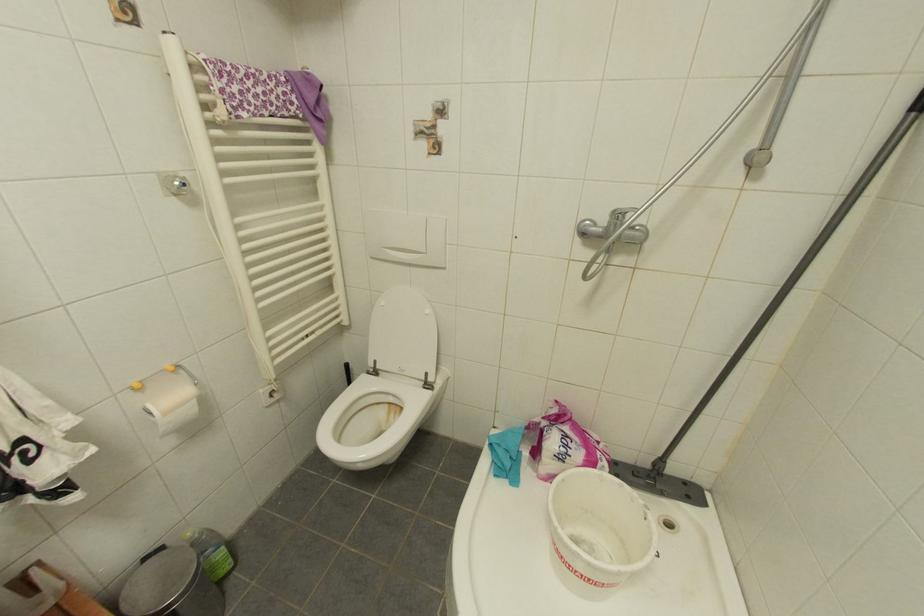
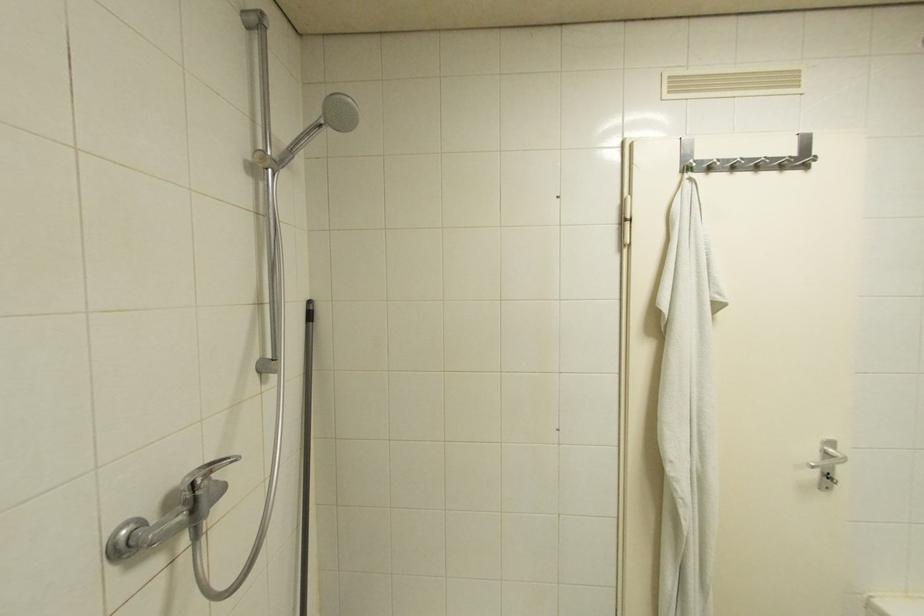
Question: The first image is from the beginning of the video and the second image is from the end. How did the camera likely rotate when shooting the video?

Choices:
 (A) Left
 (B) Right
 (C) Up
 (D) Down

Answer: (B)